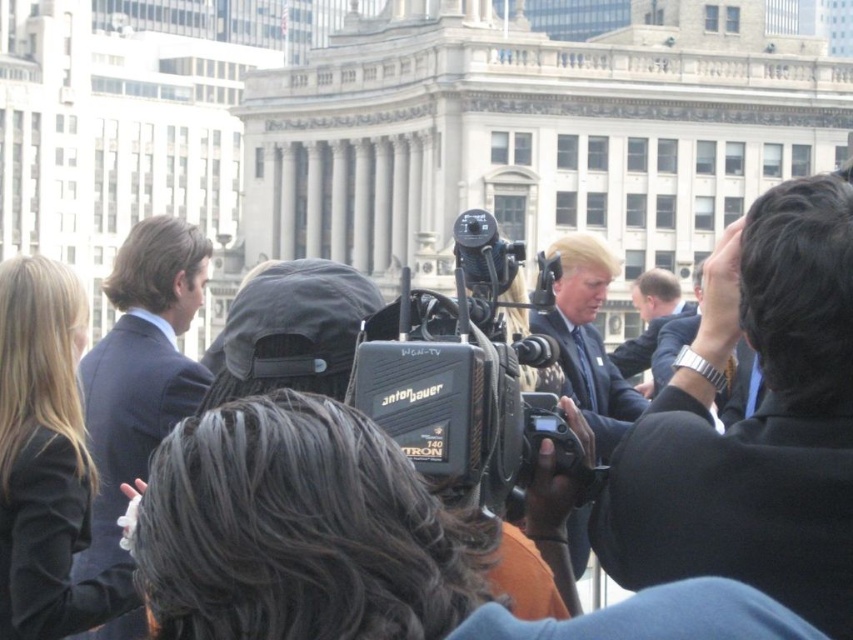
Based on the photo, who is higher up, black suit at upper right or light brown suit at center?

light brown suit at center is above.

Is black suit at upper right to the left of light brown suit at center from the viewer's perspective?

Yes, black suit at upper right is to the left of light brown suit at center.

I want to click on black suit at upper right, so click(x=753, y=422).

Locate an element on the screen. The width and height of the screenshot is (853, 640). black suit at upper right is located at coordinates (753, 422).

The width and height of the screenshot is (853, 640). What do you see at coordinates (753, 422) in the screenshot?
I see `black suit at upper right` at bounding box center [753, 422].

Who is taller, black suit at upper right or dark blue suit at left?

Standing taller between the two is dark blue suit at left.

Who is more forward, (666, 442) or (94, 401)?

Point (666, 442)

Where is `black suit at upper right`? Image resolution: width=853 pixels, height=640 pixels. black suit at upper right is located at coordinates (753, 422).

Can you confirm if dark blue suit at left is positioned to the right of silver metallic watch at upper right?

No, dark blue suit at left is not to the right of silver metallic watch at upper right.

Can you confirm if dark blue suit at left is smaller than silver metallic watch at upper right?

No, dark blue suit at left is not smaller than silver metallic watch at upper right.

You are a GUI agent. You are given a task and a screenshot of the screen. Output one action in this format:
    pyautogui.click(x=<x>, y=<y>)
    Task: Click on the dark blue suit at left
    The height and width of the screenshot is (640, 853).
    Given the screenshot: What is the action you would take?
    pyautogui.click(x=140, y=368)

Locate an element on the screen. The height and width of the screenshot is (640, 853). dark blue suit at left is located at coordinates (140, 368).